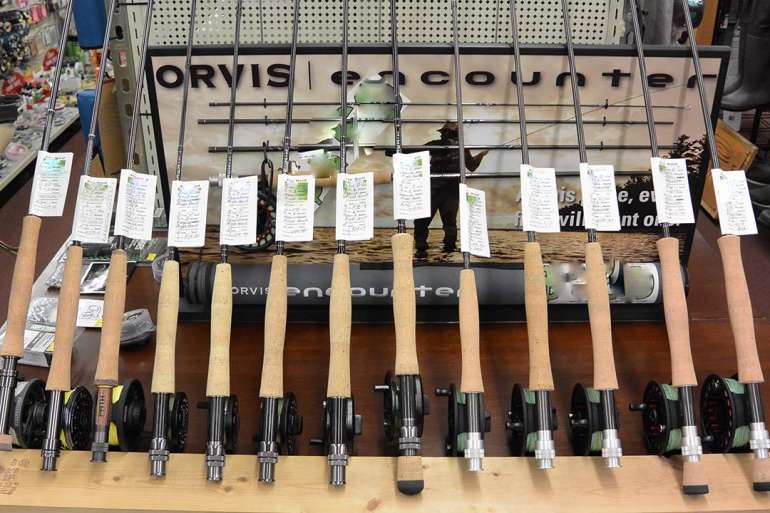
Where is `rounded wooden handle`? The height and width of the screenshot is (513, 770). rounded wooden handle is located at coordinates (168, 330).